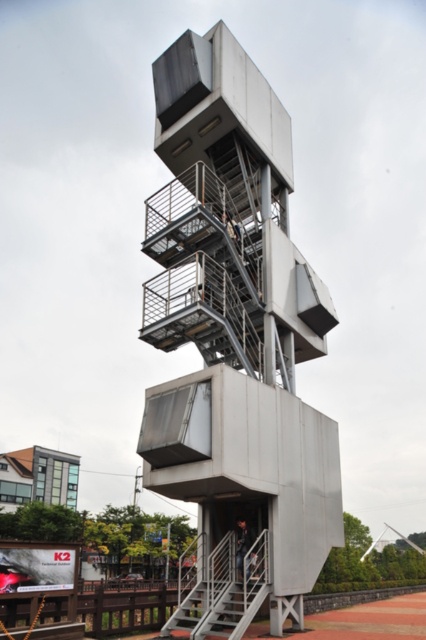
Question: Which point is closer to the camera?

Choices:
 (A) metallic gray stairs at center
 (B) metallic silver observation tower at center

Answer: (A)

Question: Does metallic silver observation tower at center appear under metallic gray stairs at center?

Choices:
 (A) no
 (B) yes

Answer: (A)

Question: Is metallic silver observation tower at center positioned at the back of metallic gray stairs at center?

Choices:
 (A) no
 (B) yes

Answer: (B)

Question: Is metallic silver observation tower at center above metallic gray stairs at center?

Choices:
 (A) no
 (B) yes

Answer: (B)